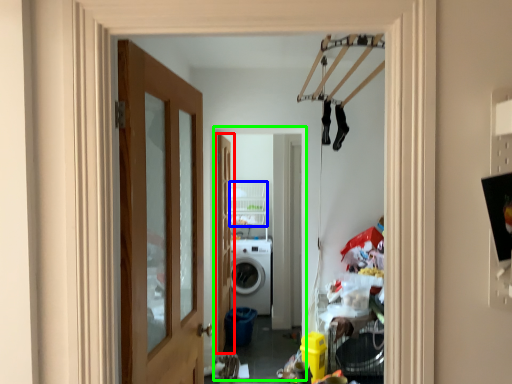
Question: Based on their relative distances, which object is farther from door (highlighted by a red box)? Choose from shelf (highlighted by a blue box) and corridor (highlighted by a green box).

Choices:
 (A) shelf
 (B) corridor

Answer: (A)